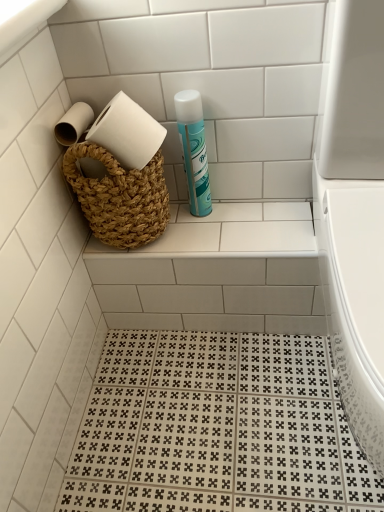
What do you see at coordinates (194, 150) in the screenshot?
I see `teal matte cleaning product at upper center` at bounding box center [194, 150].

The width and height of the screenshot is (384, 512). What are the coordinates of `teal matte cleaning product at upper center` in the screenshot? It's located at (194, 150).

Locate an element on the screen. natural woven basket at upper center is located at coordinates (238, 230).

This screenshot has width=384, height=512. What do you see at coordinates (238, 230) in the screenshot?
I see `natural woven basket at upper center` at bounding box center [238, 230].

Measure the distance between white glossy toilet at right and camera.

The distance of white glossy toilet at right from camera is 46.33 centimeters.

The height and width of the screenshot is (512, 384). In order to click on teal matte cleaning product at upper center in this screenshot , I will do `click(194, 150)`.

What's the angular difference between teal matte cleaning product at upper center and natural woven basket at upper center's facing directions?

0.551 degrees.

Considering the positions of objects teal matte cleaning product at upper center and natural woven basket at upper center in the image provided, who is more to the left, teal matte cleaning product at upper center or natural woven basket at upper center?

From the viewer's perspective, natural woven basket at upper center appears more on the left side.

Considering the positions of point (201, 136) and point (270, 237), is point (201, 136) closer or farther from the camera than point (270, 237)?

Point (201, 136).

Is teal matte cleaning product at upper center facing away from natural woven basket at upper center?

No, teal matte cleaning product at upper center's orientation is not away from natural woven basket at upper center.

Is natural woven basket at upper center not within white glossy toilet at right?

natural woven basket at upper center lies outside white glossy toilet at right's area.

Is natural woven basket at upper center next to white glossy toilet at right and touching it?

No, natural woven basket at upper center is not making contact with white glossy toilet at right.

From a real-world perspective, who is located lower, natural woven basket at upper center or white glossy toilet at right?

From a 3D spatial view, natural woven basket at upper center is below.

Which is closer to the camera, (275, 242) or (356, 325)?

Clearly, point (275, 242) is more distant from the camera than point (356, 325).

Looking at this image, from a real-world perspective, which is physically below, teal matte cleaning product at upper center or white glossy toilet at right?

From a 3D spatial view, white glossy toilet at right is below.

Is teal matte cleaning product at upper center positioned far away from white glossy toilet at right?

No, there isn't a large distance between teal matte cleaning product at upper center and white glossy toilet at right.

Can you tell me how much teal matte cleaning product at upper center and white glossy toilet at right differ in facing direction?

teal matte cleaning product at upper center and white glossy toilet at right are facing 4.1 degrees away from each other.

Would you say white glossy toilet at right is outside teal matte cleaning product at upper center?

Yes, white glossy toilet at right is located beyond the bounds of teal matte cleaning product at upper center.

Does white glossy toilet at right appear on the left side of teal matte cleaning product at upper center?

In fact, white glossy toilet at right is to the right of teal matte cleaning product at upper center.

Is the depth of white glossy toilet at right greater than that of natural woven basket at upper center?

No, white glossy toilet at right is in front of natural woven basket at upper center.

Find the location of a particular element. This screenshot has width=384, height=512. ledge lying on the left of white glossy toilet at right is located at coordinates (238, 230).

Who is bigger, white glossy toilet at right or natural woven basket at upper center?

Bigger between the two is white glossy toilet at right.

Is the surface of white glossy toilet at right in direct contact with natural woven basket at upper center?

No, white glossy toilet at right is not making contact with natural woven basket at upper center.

Considering the sizes of objects natural woven basket at upper center and teal matte cleaning product at upper center in the image provided, who is wider, natural woven basket at upper center or teal matte cleaning product at upper center?

natural woven basket at upper center.

Is natural woven basket at upper center not inside teal matte cleaning product at upper center?

Yes, natural woven basket at upper center is outside of teal matte cleaning product at upper center.

Considering the relative positions of natural woven basket at upper center and teal matte cleaning product at upper center in the image provided, is natural woven basket at upper center to the left or to the right of teal matte cleaning product at upper center?

In the image, natural woven basket at upper center appears on the left side of teal matte cleaning product at upper center.

Considering the relative sizes of natural woven basket at upper center and teal matte cleaning product at upper center in the image provided, is natural woven basket at upper center smaller than teal matte cleaning product at upper center?

No.

Where is `ledge below the teal matte cleaning product at upper center (from a real-world perspective)`? This screenshot has width=384, height=512. ledge below the teal matte cleaning product at upper center (from a real-world perspective) is located at coordinates (238, 230).

Identify the location of bath in front of the natural woven basket at upper center. Image resolution: width=384 pixels, height=512 pixels. (355, 300).

Which object lies nearer to the anchor point white glossy toilet at right, teal matte cleaning product at upper center or natural woven basket at upper center?

Among the two, natural woven basket at upper center is located nearer to white glossy toilet at right.

Based on their spatial positions, is teal matte cleaning product at upper center or white glossy toilet at right further from natural woven basket at upper center?

white glossy toilet at right is positioned further to the anchor natural woven basket at upper center.

Which object lies nearer to the anchor point white glossy toilet at right, natural woven basket at upper center or teal matte cleaning product at upper center?

natural woven basket at upper center is closer to white glossy toilet at right.

Which object lies further to the anchor point teal matte cleaning product at upper center, white glossy toilet at right or natural woven basket at upper center?

The object further to teal matte cleaning product at upper center is white glossy toilet at right.

Which object lies nearer to the anchor point teal matte cleaning product at upper center, natural woven basket at upper center or white glossy toilet at right?

Based on the image, natural woven basket at upper center appears to be nearer to teal matte cleaning product at upper center.

Considering their positions, is white glossy toilet at right positioned closer to natural woven basket at upper center than teal matte cleaning product at upper center?

The object closer to natural woven basket at upper center is teal matte cleaning product at upper center.

Find the location of `cleaning product between white glossy toilet at right and natural woven basket at upper center from front to back`. cleaning product between white glossy toilet at right and natural woven basket at upper center from front to back is located at coordinates (194, 150).